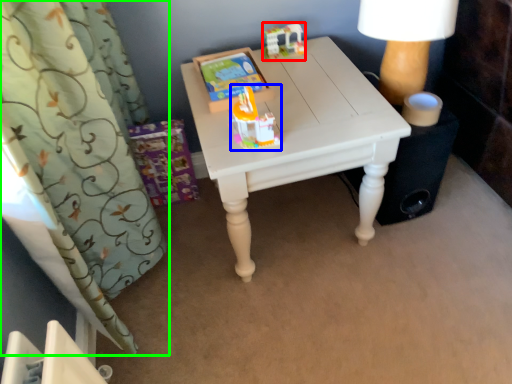
Question: Based on their relative distances, which object is nearer to toy (highlighted by a red box)? Choose from toy (highlighted by a blue box) and curtain (highlighted by a green box).

Choices:
 (A) toy
 (B) curtain

Answer: (A)